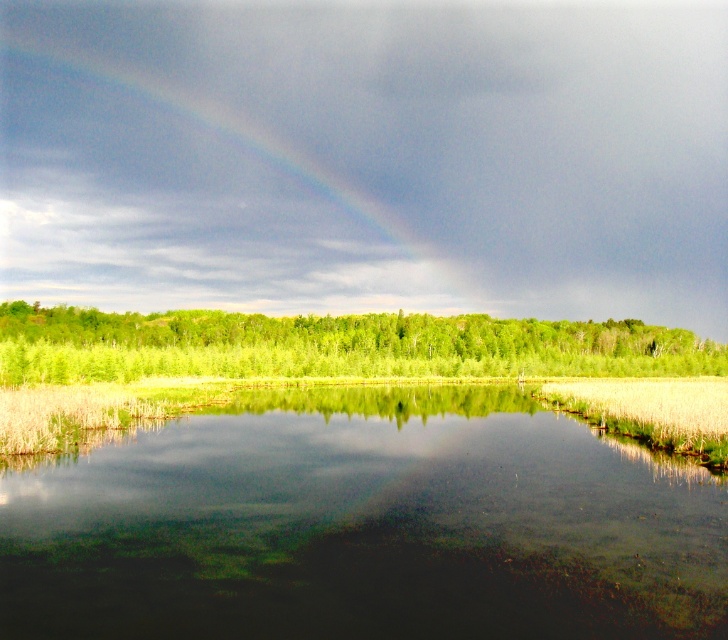
Does clear water at center have a larger size compared to green leafy trees at center?

Actually, clear water at center might be smaller than green leafy trees at center.

Is clear water at center positioned at the back of green leafy trees at center?

No, it is not.

This screenshot has width=728, height=640. Find the location of `clear water at center`. clear water at center is located at coordinates (364, 525).

Identify the location of clear water at center. (364, 525).

Can you confirm if clear water at center is shorter than rainbow at upper center?

Yes.

How much distance is there between clear water at center and rainbow at upper center?

222.50 meters

Is point (620, 476) behind point (331, 240)?

No, it is in front of (331, 240).

This screenshot has width=728, height=640. Find the location of `clear water at center`. clear water at center is located at coordinates (364, 525).

Between rainbow at upper center and green leafy trees at center, which one is positioned lower?

Positioned lower is green leafy trees at center.

Does rainbow at upper center have a larger size compared to green leafy trees at center?

Indeed, rainbow at upper center has a larger size compared to green leafy trees at center.

Who is more distant from viewer, (31, 120) or (488, 342)?

The point (31, 120) is behind.

The height and width of the screenshot is (640, 728). In order to click on rainbow at upper center in this screenshot , I will do `click(173, 209)`.